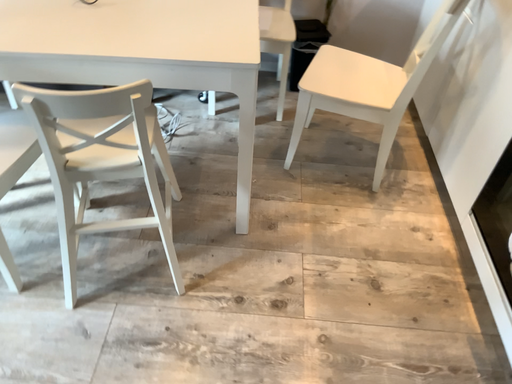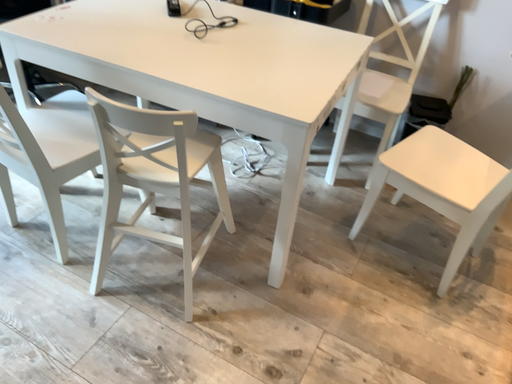
Question: Which way did the camera rotate in the video?

Choices:
 (A) rotated downward
 (B) rotated upward

Answer: (B)